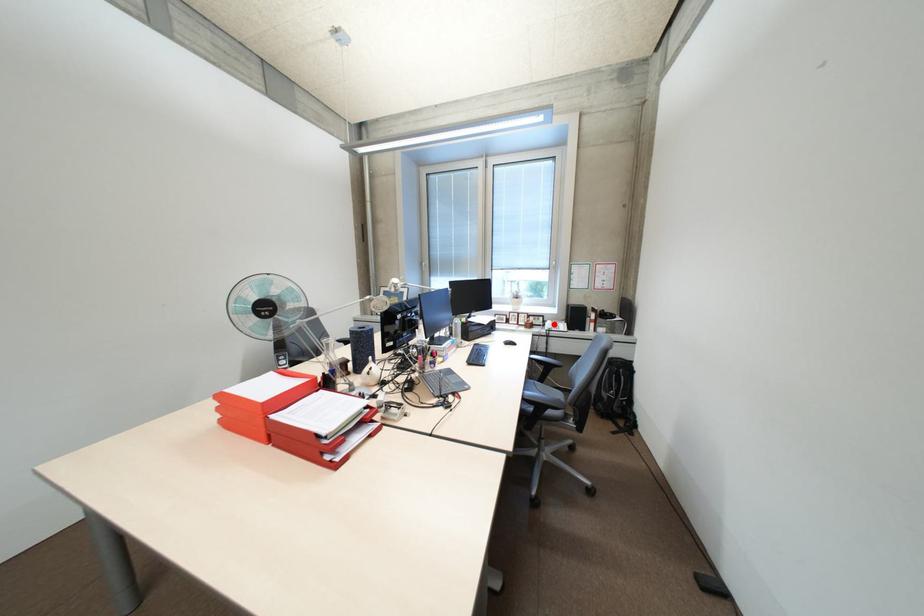
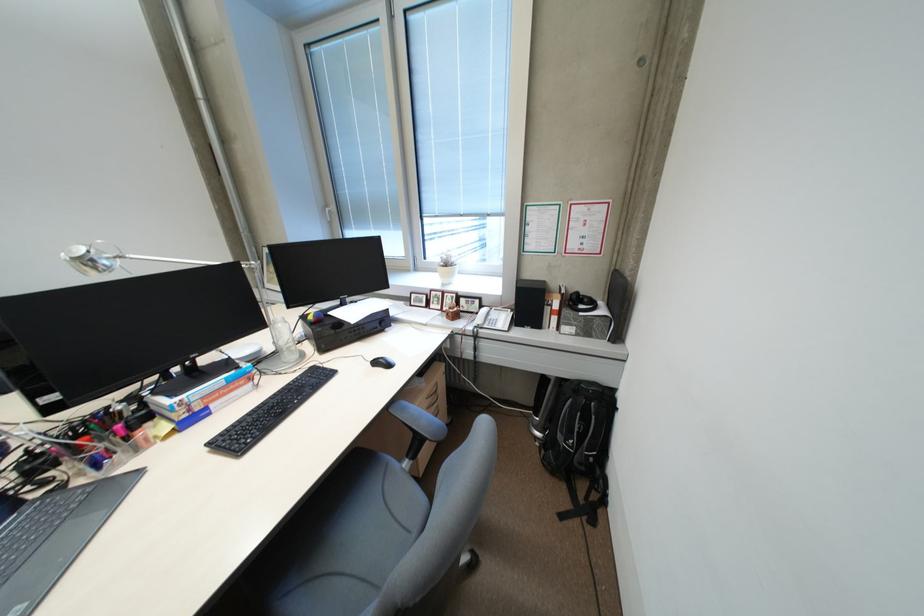
The point at the highlighted location is marked in the first image. Where is the corresponding point in the second image?

(487, 314)